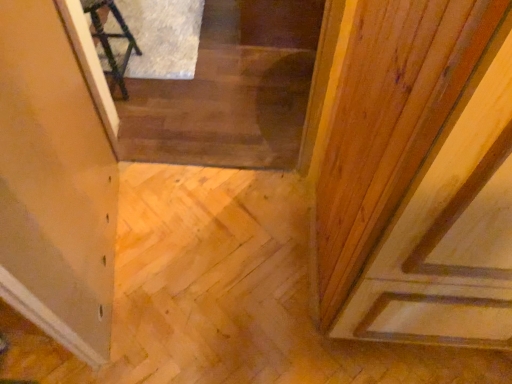
Question: Does transparent glass door at upper left have a smaller size compared to wooden stairs at center?

Choices:
 (A) no
 (B) yes

Answer: (B)

Question: Can you confirm if transparent glass door at upper left is thinner than wooden stairs at center?

Choices:
 (A) no
 (B) yes

Answer: (B)

Question: Does transparent glass door at upper left lie behind wooden stairs at center?

Choices:
 (A) yes
 (B) no

Answer: (B)

Question: Is transparent glass door at upper left shorter than wooden stairs at center?

Choices:
 (A) yes
 (B) no

Answer: (B)

Question: Is transparent glass door at upper left next to wooden stairs at center?

Choices:
 (A) no
 (B) yes

Answer: (A)

Question: Is transparent glass door at upper left at the left side of wooden stairs at center?

Choices:
 (A) no
 (B) yes

Answer: (B)

Question: From the image's perspective, is dark wood chair at upper left under transparent glass door at upper left?

Choices:
 (A) no
 (B) yes

Answer: (A)

Question: Considering the relative positions of dark wood chair at upper left and transparent glass door at upper left in the image provided, is dark wood chair at upper left behind transparent glass door at upper left?

Choices:
 (A) no
 (B) yes

Answer: (B)

Question: Does dark wood chair at upper left have a greater width compared to transparent glass door at upper left?

Choices:
 (A) no
 (B) yes

Answer: (B)

Question: Is transparent glass door at upper left completely or partially inside dark wood chair at upper left?

Choices:
 (A) no
 (B) yes

Answer: (A)

Question: Could you tell me if dark wood chair at upper left is turned towards transparent glass door at upper left?

Choices:
 (A) no
 (B) yes

Answer: (A)

Question: Considering the relative sizes of dark wood chair at upper left and transparent glass door at upper left in the image provided, is dark wood chair at upper left bigger than transparent glass door at upper left?

Choices:
 (A) no
 (B) yes

Answer: (A)

Question: Can you confirm if wooden stairs at center is smaller than dark wood chair at upper left?

Choices:
 (A) no
 (B) yes

Answer: (A)